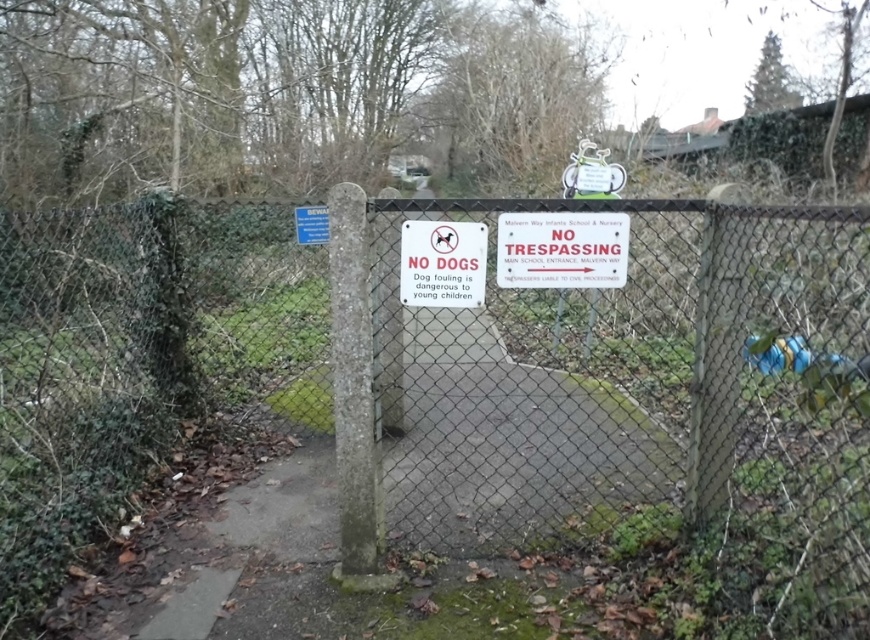
Question: Which point is closer to the camera?

Choices:
 (A) (457, 300)
 (B) (454, 518)

Answer: (A)

Question: Is concrete at center to the left of white plastic sign at center from the viewer's perspective?

Choices:
 (A) no
 (B) yes

Answer: (A)

Question: Which point is farther to the camera?

Choices:
 (A) concrete at center
 (B) red plastic sign at center

Answer: (B)

Question: Can you confirm if wire mesh fence at center is positioned to the right of white plastic sign at center?

Choices:
 (A) yes
 (B) no

Answer: (A)

Question: Which point is closer to the camera?

Choices:
 (A) red plastic sign at center
 (B) concrete at center

Answer: (B)

Question: Is wire mesh fence at center wider than red plastic sign at center?

Choices:
 (A) no
 (B) yes

Answer: (B)